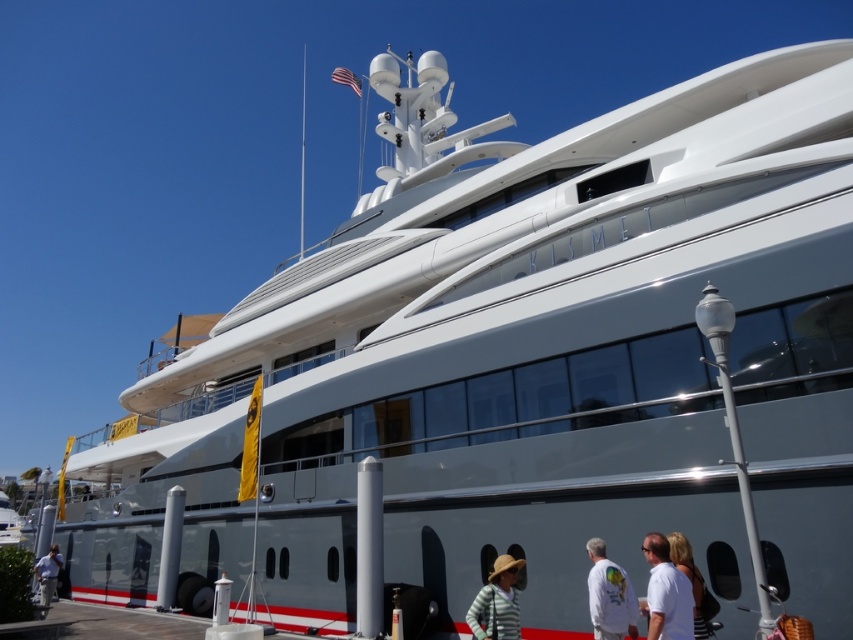
Question: Is white cotton shirt at lower right above blonde hair at lower right?

Choices:
 (A) yes
 (B) no

Answer: (B)

Question: Which point is closer to the camera taking this photo?

Choices:
 (A) (659, 566)
 (B) (701, 596)
 (C) (51, 568)
 (D) (596, 608)

Answer: (A)

Question: Does striped fabric hat at lower center come behind blonde hair at lower right?

Choices:
 (A) no
 (B) yes

Answer: (B)

Question: Considering the real-world distances, which object is closest to the white matte shirt at lower right?

Choices:
 (A) striped fabric hat at lower center
 (B) blonde hair at lower right
 (C) white cotton shirt at lower right
 (D) light blue shirt at lower left

Answer: (B)

Question: Which point is closer to the camera taking this photo?

Choices:
 (A) (679, 566)
 (B) (500, 577)
 (C) (39, 593)
 (D) (607, 589)

Answer: (A)

Question: Does striped fabric hat at lower center appear on the right side of light blue shirt at lower left?

Choices:
 (A) no
 (B) yes

Answer: (B)